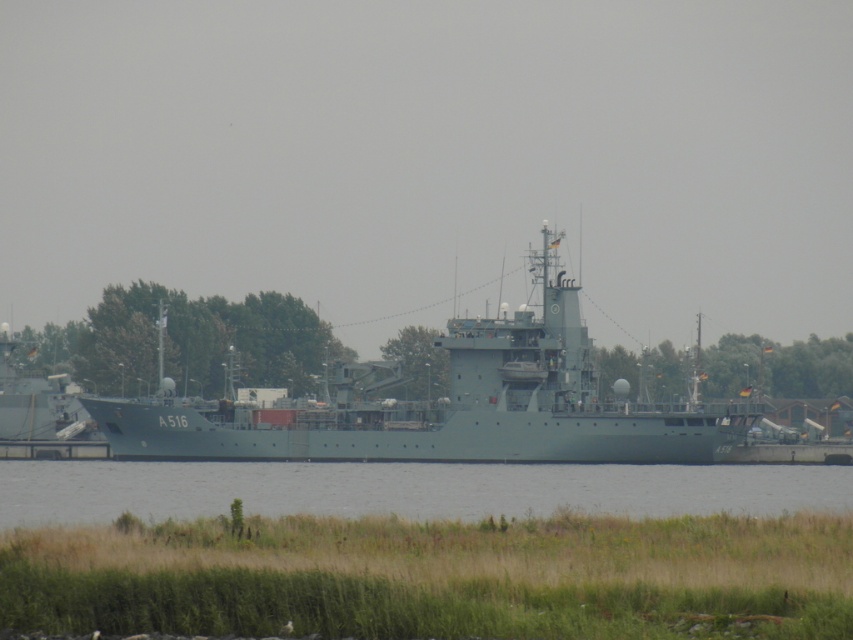
From the picture: Does matte gray ship at center appear on the left side of green matte ship at left?

No, matte gray ship at center is not to the left of green matte ship at left.

Which is in front, point (395, 438) or point (26, 404)?

Point (395, 438) is more forward.

This screenshot has width=853, height=640. What do you see at coordinates (448, 404) in the screenshot?
I see `matte gray ship at center` at bounding box center [448, 404].

This screenshot has height=640, width=853. I want to click on matte gray ship at center, so click(448, 404).

Between gray water at lower center and green matte ship at left, which one is positioned lower?

Positioned lower is gray water at lower center.

Between gray water at lower center and green matte ship at left, which one appears on the right side from the viewer's perspective?

gray water at lower center is more to the right.

I want to click on gray water at lower center, so click(405, 490).

Find the location of a particular element. The image size is (853, 640). gray water at lower center is located at coordinates (405, 490).

Identify the location of matte gray ship at center. (448, 404).

Who is positioned more to the right, matte gray ship at center or gray water at lower center?

matte gray ship at center is more to the right.

In order to click on matte gray ship at center in this screenshot , I will do `click(448, 404)`.